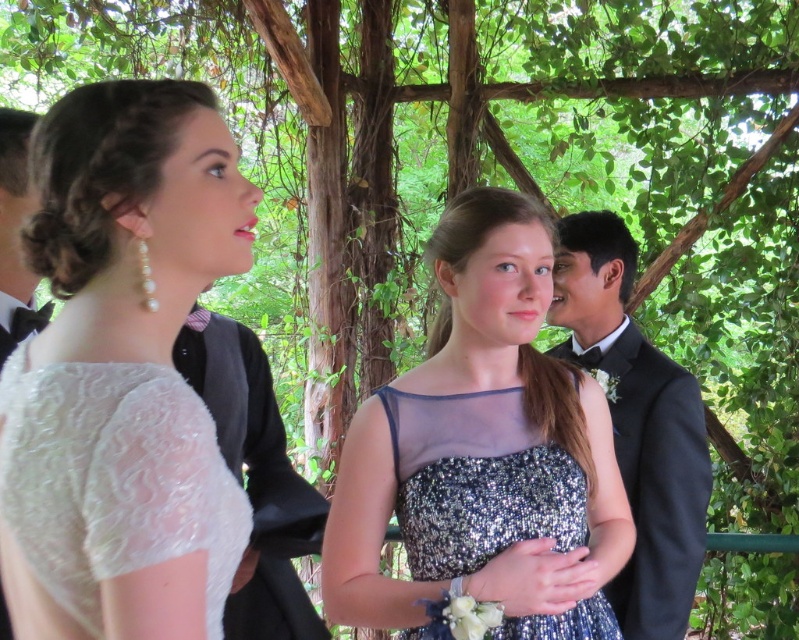
Based on the photo, you are a photographer at the event and want to capture both the pearl lace dress at upper left and the sparkly blue dress at center in a single frame. Which dress will appear smaller in the photo?

The pearl lace dress at upper left will appear smaller in the photo because it occupies less space than the sparkly blue dress at center.

You are a photographer at the event and need to adjust your camera focus. Since the sparkly silver dress at center and the black satin bow tie at upper left are both in the frame, which one should you focus on first to ensure proper depth of field?

The sparkly silver dress at center should be focused on first because it has a greater height compared to the black satin bow tie at upper left, ensuring the main subject is in focus.